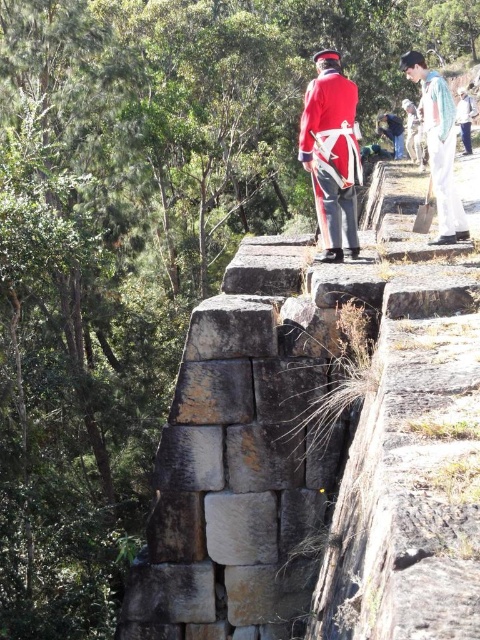
Question: Estimate the real-world distances between objects in this image. Which object is closer to the rustic stone wall at center?

Choices:
 (A) red woolen coat at upper center
 (B) red woolen coat at upper right
 (C) white cotton shirt at upper right

Answer: (C)

Question: Can you confirm if red fabric uniform at center is bigger than red woolen coat at upper right?

Choices:
 (A) no
 (B) yes

Answer: (A)

Question: Is white cotton shirt at upper right to the right of red woolen coat at upper center from the viewer's perspective?

Choices:
 (A) yes
 (B) no

Answer: (B)

Question: Which point is closer to the camera taking this photo?

Choices:
 (A) (243, 483)
 (B) (468, 140)
 (C) (435, 74)

Answer: (A)

Question: Can you confirm if red fabric uniform at center is smaller than white cotton shirt at upper right?

Choices:
 (A) no
 (B) yes

Answer: (B)

Question: Among these objects, which one is farthest from the camera?

Choices:
 (A) rustic stone wall at center
 (B) red fabric uniform at center
 (C) red woolen coat at upper center
 (D) red woolen coat at upper right

Answer: (C)